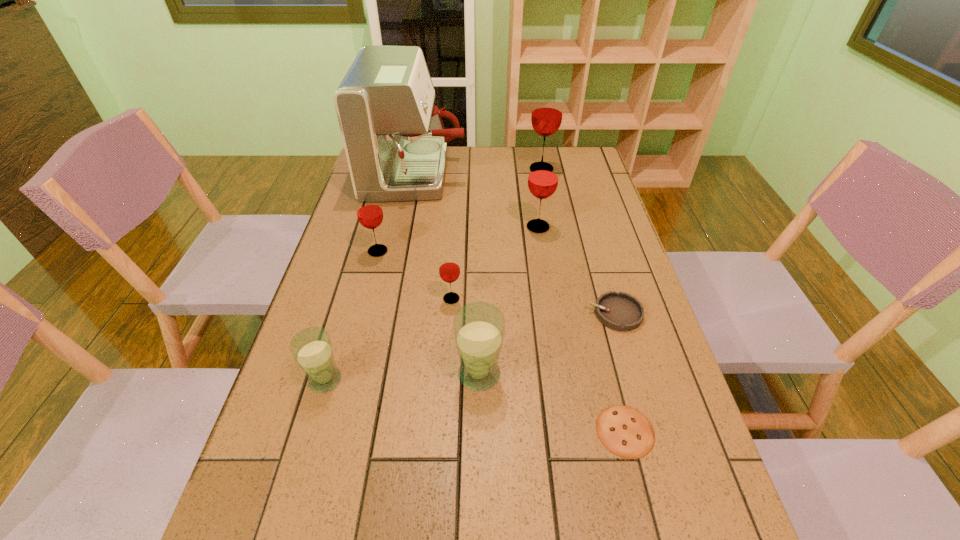
What are the coordinates of `free space located on the right of the right blue glass` in the screenshot? It's located at (624, 374).

This screenshot has width=960, height=540. I want to click on vacant space situated on the front of the fourth farthest glass, so click(449, 325).

Identify the location of vacant position located 0.110m on the right of the left blue glass. (394, 380).

Identify the location of vacant space situated on the left of the second shortest object. tap(512, 313).

Find the location of a particular element. The width and height of the screenshot is (960, 540). free space located 0.060m on the left of the nearest object is located at coordinates (566, 431).

What are the coordinates of `coffee maker that is at the far edge` in the screenshot? It's located at (395, 142).

This screenshot has height=540, width=960. Identify the location of glass that is at the far edge. (547, 112).

Locate an element on the screen. coffee maker at the left edge is located at coordinates (395, 142).

Locate an element on the screen. The width and height of the screenshot is (960, 540). glass that is at the right edge is located at coordinates (547, 112).

The image size is (960, 540). Identify the location of ashtray situated at the right edge. (621, 311).